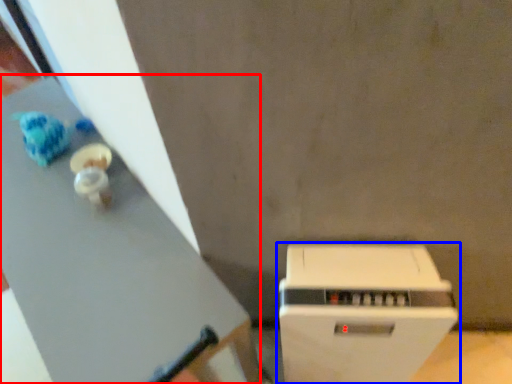
Question: Which of the following is the farthest to the observer, table (highlighted by a red box) or home appliance (highlighted by a blue box)?

Choices:
 (A) table
 (B) home appliance

Answer: (A)